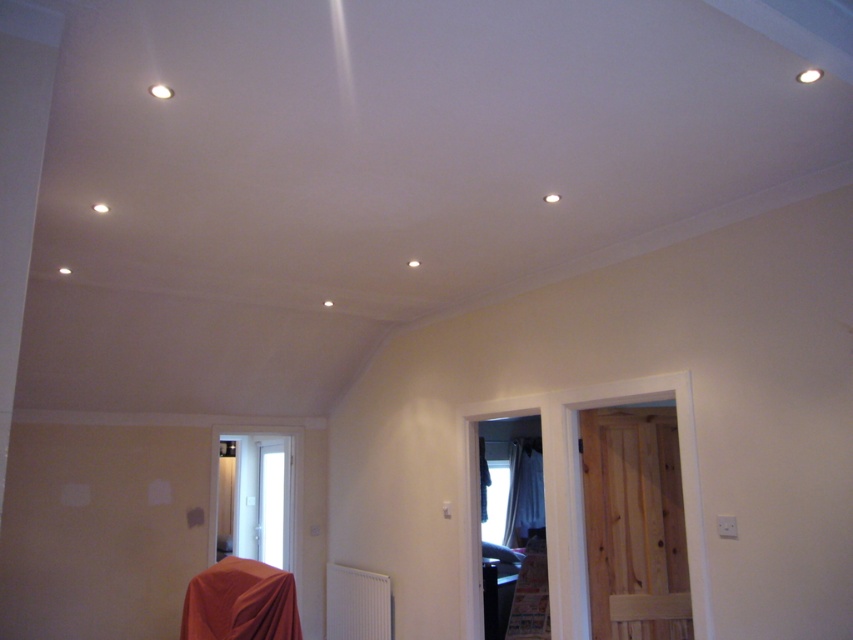
In the scene shown: You are a decorator trying to decide where to place a new floor lamp. You have two options in the room shown. The orange fabric at lower left and the white sheer curtain at right. Which object is shorter and would be better suited for placing the lamp next to?

The orange fabric at lower left is not as tall as the white sheer curtain at right, so it would be better to place the lamp next to the orange fabric at lower left since it is shorter and the lamp can be positioned without blocking the taller curtain.

You are a decorator planning to place a large piece of artwork that requires a minimum of 2 meters in width. You see the orange fabric at lower left and the white sheer curtain at right in the room. Which object can accommodate the artwork based on their sizes?

The orange fabric at lower left is bigger than the white sheer curtain at right, so the orange fabric at lower left can accommodate the artwork as it meets the minimum width requirement.